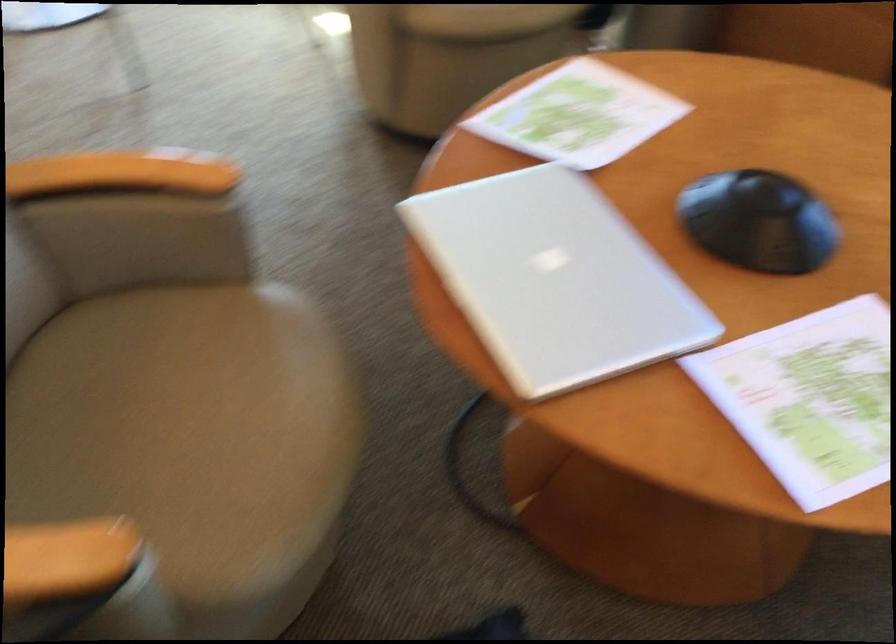
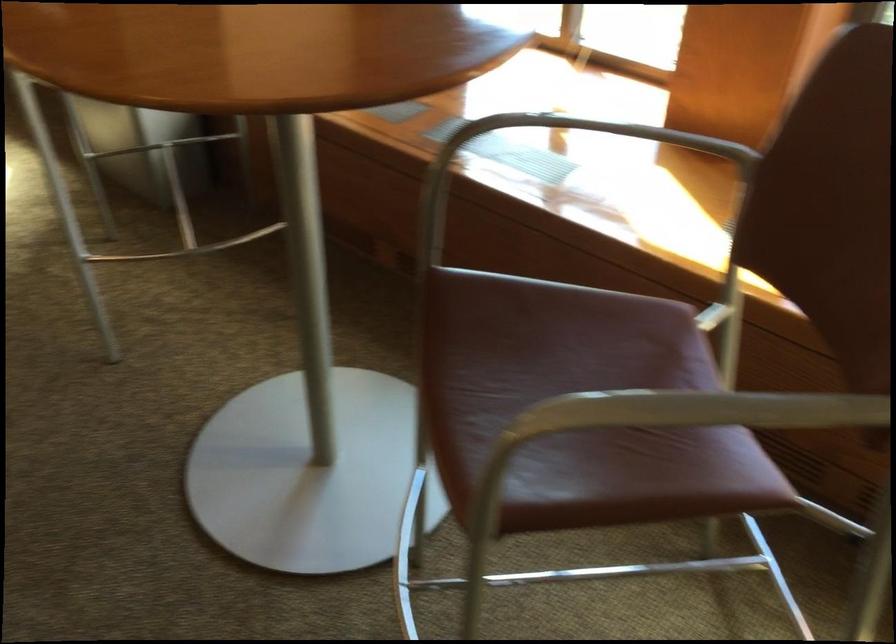
The images are taken continuously from a first-person perspective. In which direction are you moving?

The cameraman walked toward left, forward.